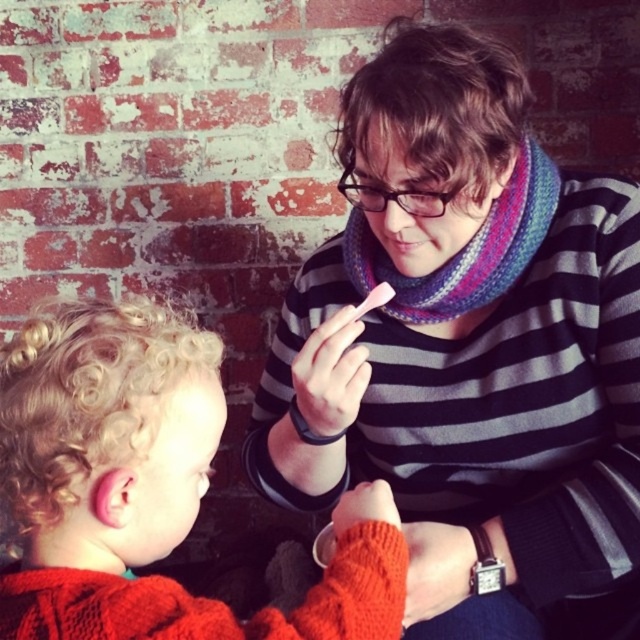
Question: Is striped sweater at center positioned at the back of cabled knit sweater at lower left?

Choices:
 (A) yes
 (B) no

Answer: (A)

Question: Which point appears closest to the camera in this image?

Choices:
 (A) click(74, 435)
 (B) click(468, 321)
 (C) click(497, 240)

Answer: (A)

Question: Is cabled knit sweater at lower left thinner than knitted multicolored scarf at center?

Choices:
 (A) no
 (B) yes

Answer: (A)

Question: Is cabled knit sweater at lower left below pink matte lips at center?

Choices:
 (A) no
 (B) yes

Answer: (B)

Question: Estimate the real-world distances between objects in this image. Which object is farther from the knitted multicolored scarf at center?

Choices:
 (A) pink matte lips at center
 (B) striped sweater at center
 (C) cabled knit sweater at lower left

Answer: (C)

Question: Which object is closer to the camera taking this photo?

Choices:
 (A) cabled knit sweater at lower left
 (B) striped sweater at center
 (C) knitted multicolored scarf at center

Answer: (A)